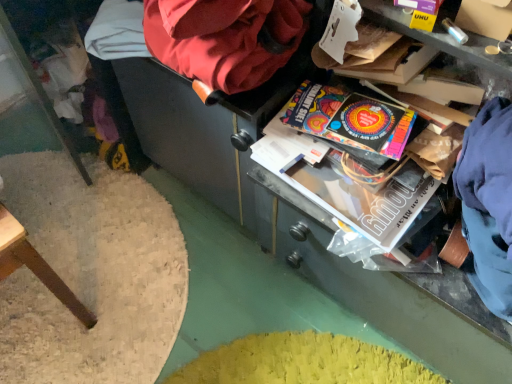
Question: Is vibrant paper at center completely or partially inside velvet-like red bean bag chair at upper center?

Choices:
 (A) no
 (B) yes

Answer: (A)

Question: From the image's perspective, would you say velvet-like red bean bag chair at upper center is shown under vibrant paper at center?

Choices:
 (A) yes
 (B) no

Answer: (B)

Question: From a real-world perspective, does velvet-like red bean bag chair at upper center sit lower than vibrant paper at center?

Choices:
 (A) no
 (B) yes

Answer: (A)

Question: Is velvet-like red bean bag chair at upper center aimed at vibrant paper at center?

Choices:
 (A) yes
 (B) no

Answer: (B)

Question: Does velvet-like red bean bag chair at upper center have a greater height compared to vibrant paper at center?

Choices:
 (A) yes
 (B) no

Answer: (A)

Question: Can we say velvet-like red bean bag chair at upper center lies outside vibrant paper at center?

Choices:
 (A) yes
 (B) no

Answer: (A)

Question: From the image's perspective, is vibrant paper at center over velvet-like red bean bag chair at upper center?

Choices:
 (A) yes
 (B) no

Answer: (B)

Question: Is velvet-like red bean bag chair at upper center at the back of vibrant paper at center?

Choices:
 (A) no
 (B) yes

Answer: (A)

Question: Is vibrant paper at center to the left of velvet-like red bean bag chair at upper center from the viewer's perspective?

Choices:
 (A) yes
 (B) no

Answer: (B)

Question: Can you confirm if vibrant paper at center is positioned to the right of velvet-like red bean bag chair at upper center?

Choices:
 (A) no
 (B) yes

Answer: (B)

Question: Does vibrant paper at center have a greater height compared to velvet-like red bean bag chair at upper center?

Choices:
 (A) no
 (B) yes

Answer: (A)

Question: From a real-world perspective, is vibrant paper at center located beneath velvet-like red bean bag chair at upper center?

Choices:
 (A) yes
 (B) no

Answer: (A)

Question: Does point (259, 29) appear closer or farther from the camera than point (373, 127)?

Choices:
 (A) closer
 (B) farther

Answer: (A)